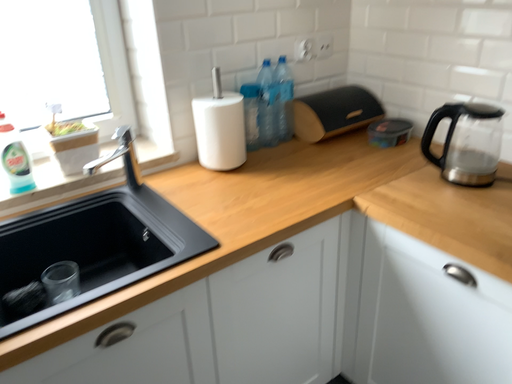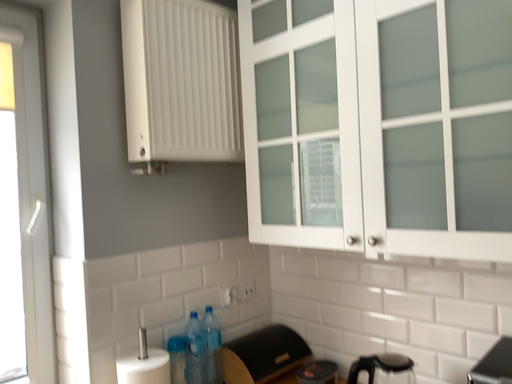
Question: Which way did the camera rotate in the video?

Choices:
 (A) rotated upward
 (B) rotated downward

Answer: (A)